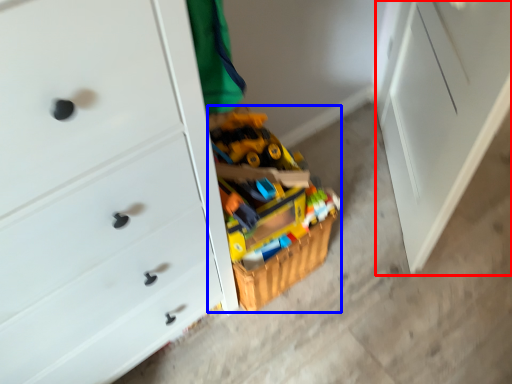
Question: Which object appears closest to the camera in this image, file cabinet (highlighted by a red box) or toy (highlighted by a blue box)?

Choices:
 (A) file cabinet
 (B) toy

Answer: (A)